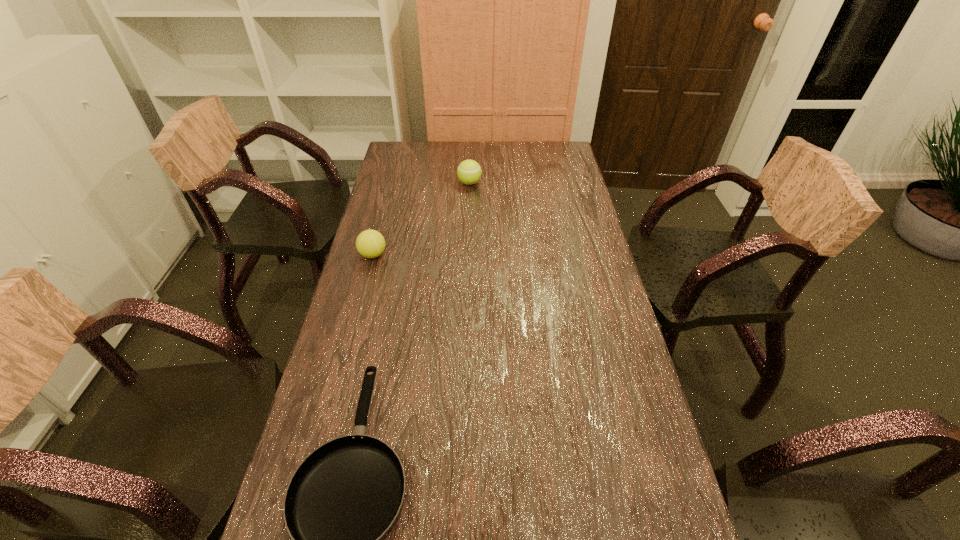
Find the location of a particular element. This screenshot has width=960, height=540. vacant space at the far left corner is located at coordinates (420, 154).

In the image, there is a desktop. Where is `blank space at the far right corner`? The width and height of the screenshot is (960, 540). blank space at the far right corner is located at coordinates (559, 145).

This screenshot has height=540, width=960. Identify the location of free spot between the nearer tennis ball and the right tennis ball. (421, 219).

Find the location of a particular element. This screenshot has height=540, width=960. free space that is in between the right tennis ball and the second nearest object is located at coordinates (421, 219).

Find the location of a particular element. This screenshot has height=540, width=960. vacant area between the second farthest object and the rightmost object is located at coordinates (421, 219).

The image size is (960, 540). Identify the location of object that stands as the second closest to the frying pan. (469, 172).

Locate an element on the screen. Image resolution: width=960 pixels, height=540 pixels. object that is the closest to the shortest object is located at coordinates (370, 243).

Locate an element on the screen. This screenshot has height=540, width=960. free space that satisfies the following two spatial constraints: 1. on the back side of the farther tennis ball; 2. on the left side of the second nearest object is located at coordinates (392, 183).

Find the location of a particular element. The height and width of the screenshot is (540, 960). vacant space that satisfies the following two spatial constraints: 1. on the back side of the rightmost object; 2. on the right side of the left tennis ball is located at coordinates (392, 183).